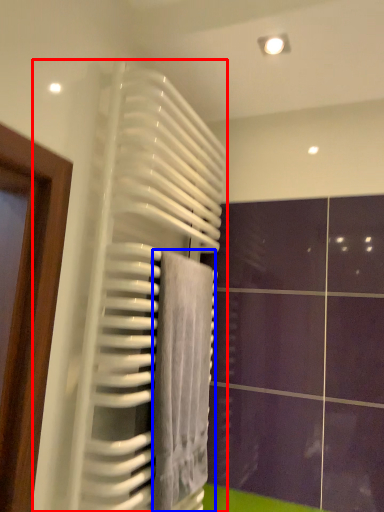
Question: Which point is further to the camera, radiator (highlighted by a red box) or towel (highlighted by a blue box)?

Choices:
 (A) radiator
 (B) towel

Answer: (B)